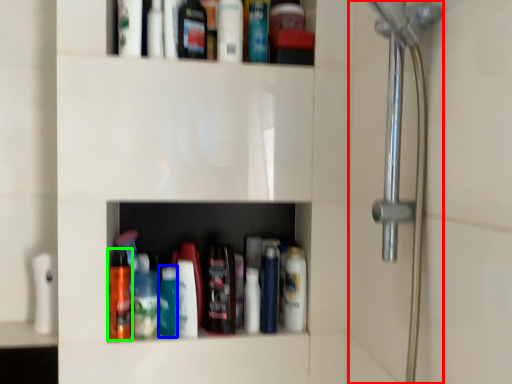
Question: Estimate the real-world distances between objects in this image. Which object is farther from shower door (highlighted by a red box), bottle (highlighted by a blue box) or mouthwash (highlighted by a green box)?

Choices:
 (A) bottle
 (B) mouthwash

Answer: (B)